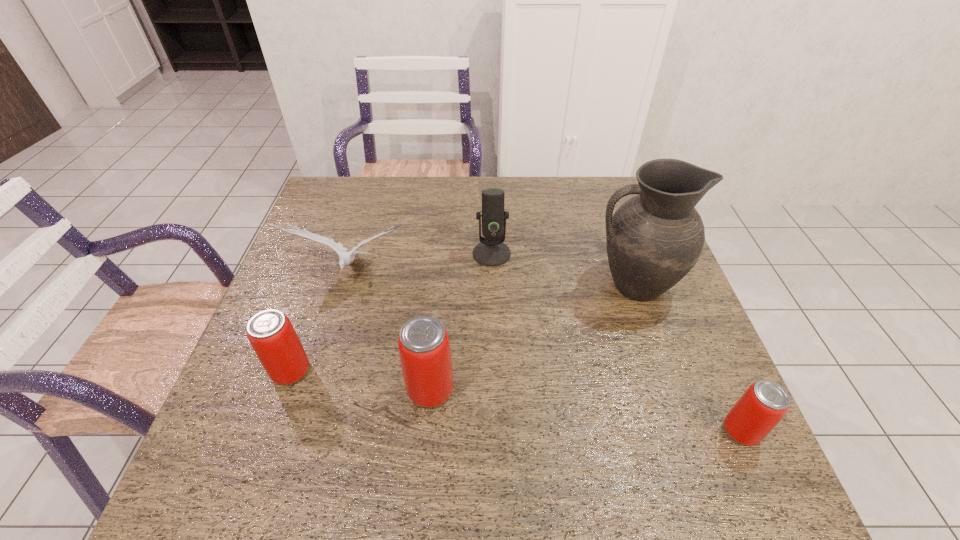
Choose which beer can is the second nearest neighbor to the leftmost beer can. Please provide its 2D coordinates. Your answer should be formatted as a tuple, i.e. [(x, y)], where the tuple contains the x and y coordinates of a point satisfying the conditions above.

[(762, 406)]

The image size is (960, 540). I want to click on blank area in the image that satisfies the following two spatial constraints: 1. at the tip of the beak of the rightmost beer can; 2. on the left side of the gull, so click(306, 431).

Find the location of a particular element. free spot that satisfies the following two spatial constraints: 1. at the tip of the beak of the second beer can from left to right; 2. on the left side of the gull is located at coordinates (318, 389).

This screenshot has width=960, height=540. Identify the location of blank space that satisfies the following two spatial constraints: 1. on the back side of the leftmost beer can; 2. on the left side of the microphone. (332, 254).

Where is `free space that satisfies the following two spatial constraints: 1. on the front side of the third object from left to right; 2. on the right side of the shortest object`? Image resolution: width=960 pixels, height=540 pixels. free space that satisfies the following two spatial constraints: 1. on the front side of the third object from left to right; 2. on the right side of the shortest object is located at coordinates (427, 431).

Identify the location of free space that satisfies the following two spatial constraints: 1. on the side of the pitcher with the handle; 2. on the front side of the second beer can from right to left. (669, 389).

Where is `blank space that satisfies the following two spatial constraints: 1. on the back side of the second shortest beer can; 2. on the left side of the microphone`? The width and height of the screenshot is (960, 540). blank space that satisfies the following two spatial constraints: 1. on the back side of the second shortest beer can; 2. on the left side of the microphone is located at coordinates coord(332,254).

Identify the location of vacant space that satisfies the following two spatial constraints: 1. on the front side of the fourth object from right to left; 2. on the left side of the second tallest beer can. (284, 389).

You are a GUI agent. You are given a task and a screenshot of the screen. Output one action in this format:
    pyautogui.click(x=<x>, y=<y>)
    Task: Click on the blank area in the image that satisfies the following two spatial constraints: 1. on the side of the shortest beer can with the handle; 2. on the right side of the tallest object
    Image resolution: width=960 pixels, height=540 pixels.
    Given the screenshot: What is the action you would take?
    pyautogui.click(x=684, y=431)

The width and height of the screenshot is (960, 540). Identify the location of vacant space that satisfies the following two spatial constraints: 1. on the side of the pitcher with the handle; 2. on the back side of the rightmost beer can. (684, 431).